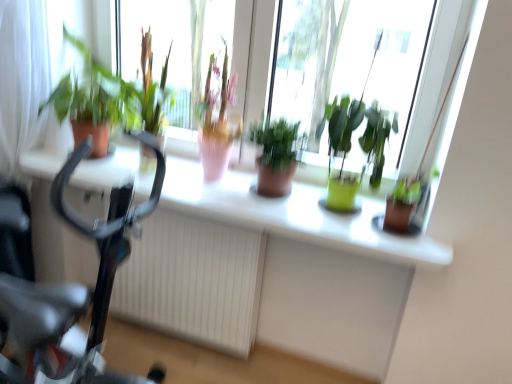
Question: From their relative heights in the image, would you say green matte plant at left, arranged as the 1th houseplant when viewed from the left, is taller or shorter than matte brown pot at center, marked as the 2th houseplant in a left-to-right arrangement?

Choices:
 (A) short
 (B) tall

Answer: (B)

Question: Relative to matte brown pot at center, marked as the 2th houseplant in a left-to-right arrangement, is green matte plant at left, the fourth houseplant positioned from the right, in front or behind?

Choices:
 (A) front
 (B) behind

Answer: (B)

Question: Estimate the real-world distances between objects in this image. Which object is closer to the matte white computer desk at center?

Choices:
 (A) green glossy plant at center, which is the third houseplant in left-to-right order
 (B) green matte plant at left, the fourth houseplant positioned from the right
 (C) green matte plant at upper center
 (D) matte brown pot at center, the 3th houseplant from the right
 (E) black glossy bicycle at left

Answer: (D)

Question: Estimate the real-world distances between objects in this image. Which object is closer to the green matte pot at right, the 1th houseplant viewed from the right?

Choices:
 (A) matte white computer desk at center
 (B) black glossy bicycle at left
 (C) green matte plant at upper center
 (D) green glossy plant at center, which is the third houseplant in left-to-right order
 (E) white textured radiator at center

Answer: (D)